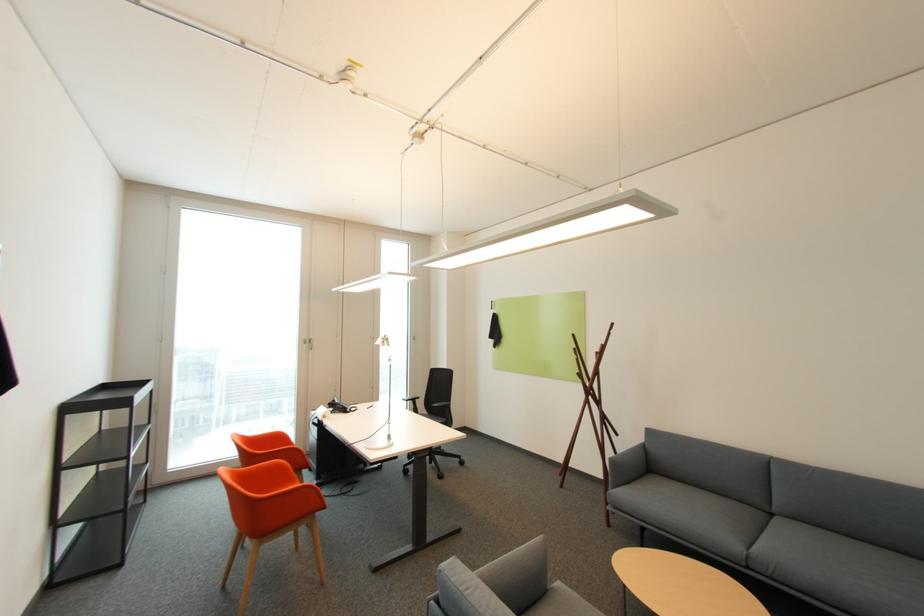
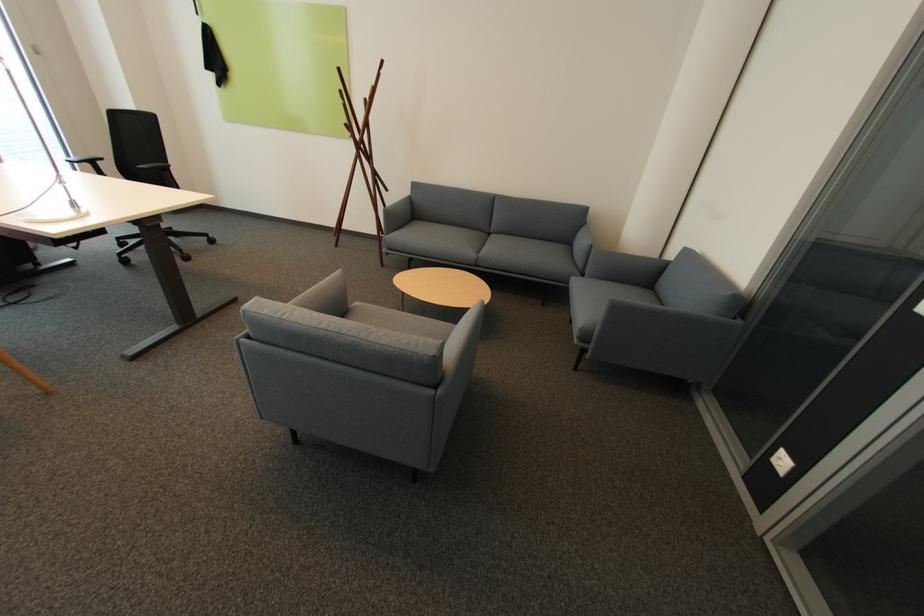
Find the pixel in the second image that matches pixel 757 569 in the first image.

(482, 265)